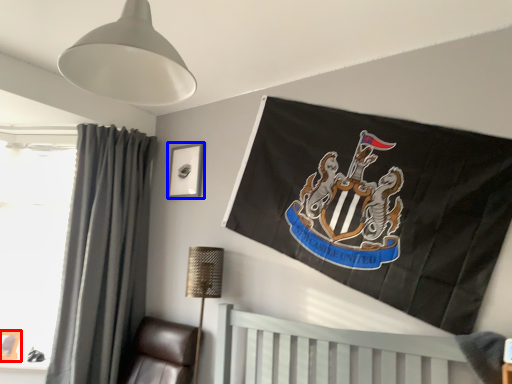
Question: Among these objects, which one is farthest to the camera, picture frame (highlighted by a red box) or picture frame (highlighted by a blue box)?

Choices:
 (A) picture frame
 (B) picture frame

Answer: (B)